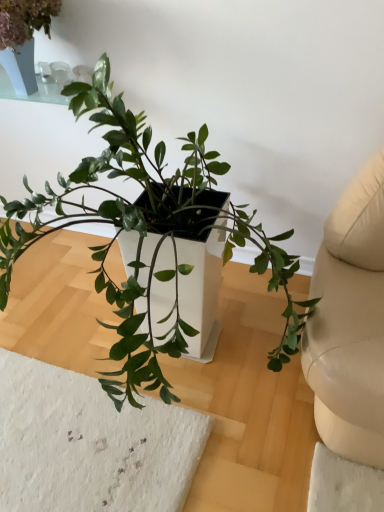
I want to click on vacant region below green matte plant at center, the 2th houseplant viewed from the left (from a real-world perspective), so click(x=187, y=371).